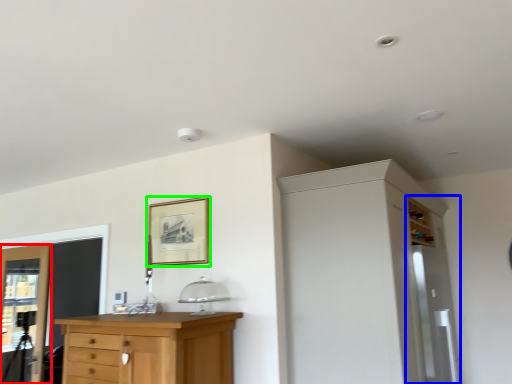
Question: Which object is positioned closest to door (highlighted by a red box)? Select from screen door (highlighted by a blue box) and picture frame (highlighted by a green box).

Choices:
 (A) screen door
 (B) picture frame

Answer: (B)